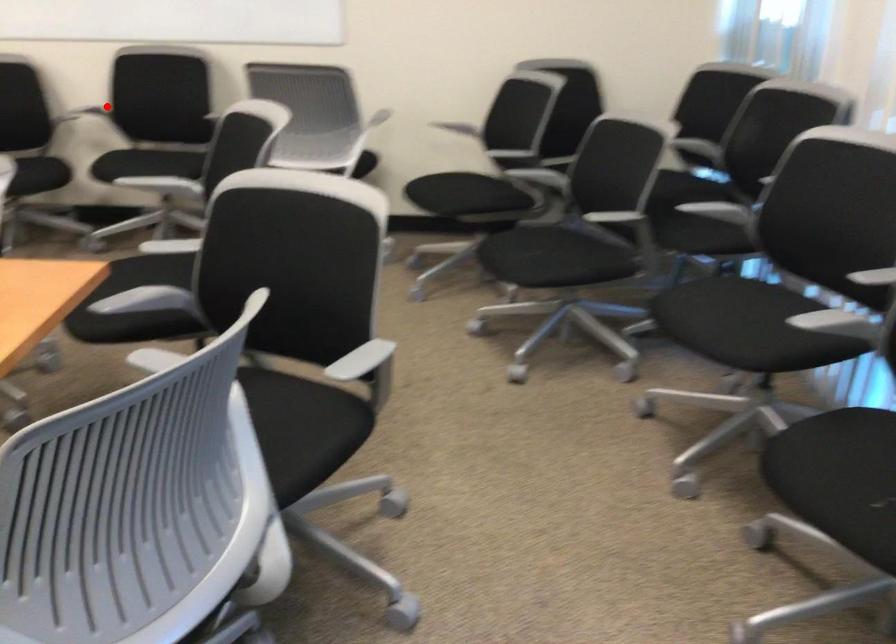
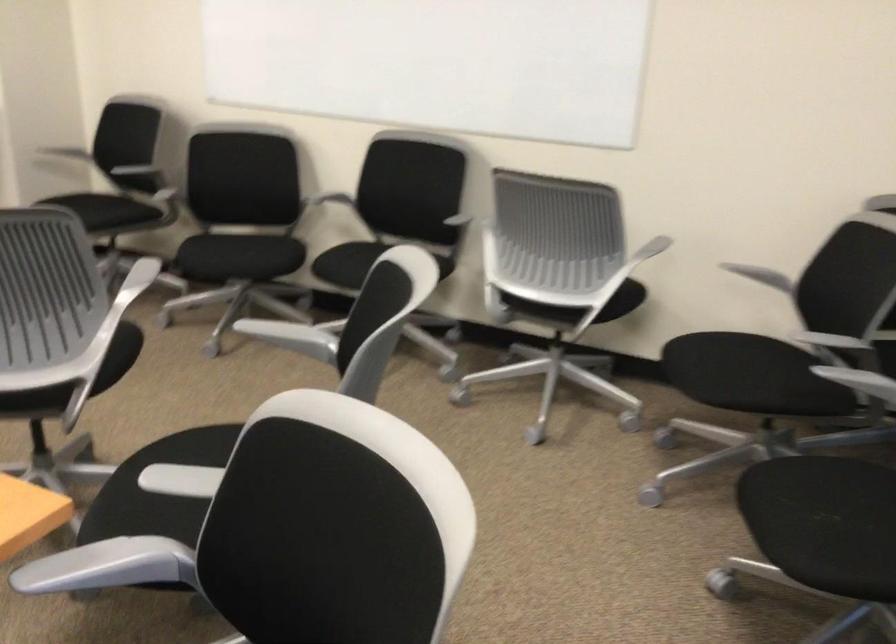
Question: I am providing you with two images of the same scene from different viewpoints. In image1, a red point is highlighted. Considering the same 3D point in image2, which of the following is correct?

Choices:
 (A) It is closer
 (B) It is farther

Answer: (A)